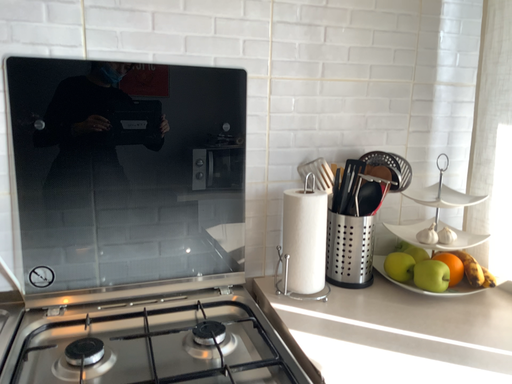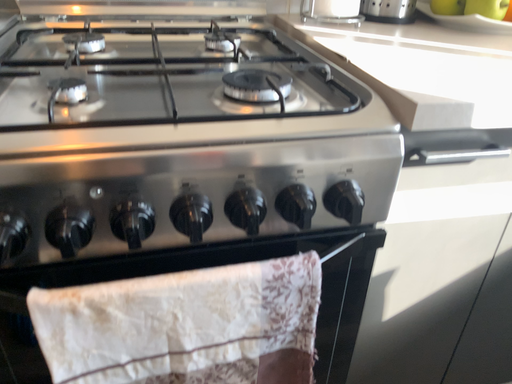
Question: Which way did the camera rotate in the video?

Choices:
 (A) rotated downward
 (B) rotated upward

Answer: (A)